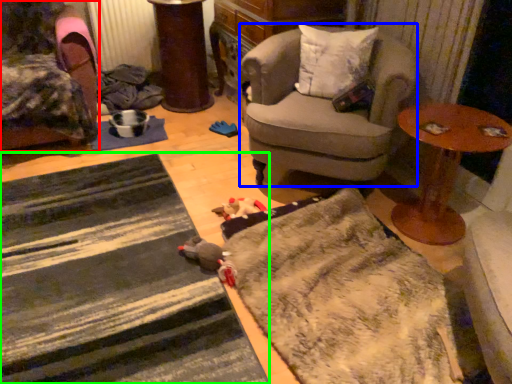
Question: Which object is the farthest from chair (highlighted by a red box)? Choose among these: chair (highlighted by a blue box) or doormat (highlighted by a green box).

Choices:
 (A) chair
 (B) doormat

Answer: (A)